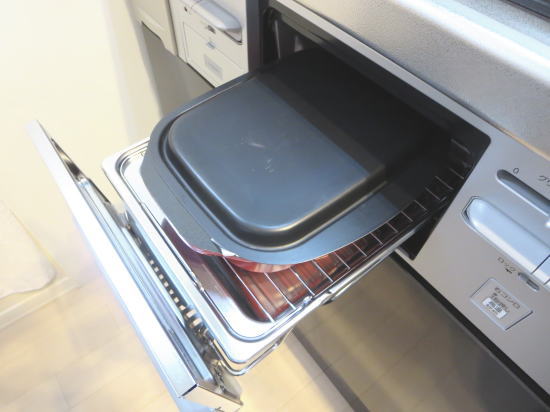
Find the location of `counter edge`. counter edge is located at coordinates (506, 35).